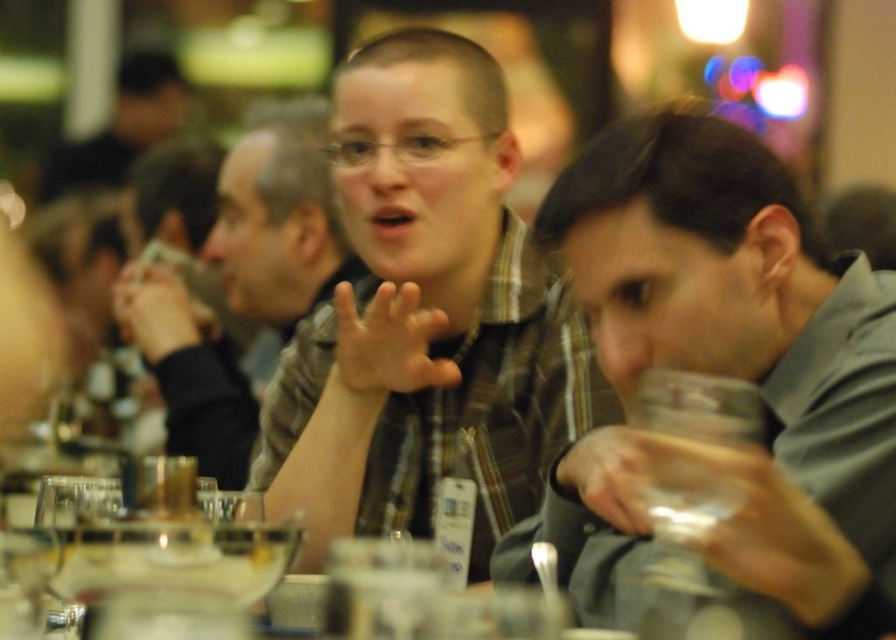
Is gray matte glass at right to the right of plaid shirt at center from the viewer's perspective?

Indeed, gray matte glass at right is positioned on the right side of plaid shirt at center.

Between point (817, 531) and point (182, 346), which one is positioned in front?

Point (817, 531)

At what (x,y) coordinates should I click in order to perform the action: click on gray matte glass at right. Please return your answer as a coordinate pair (x, y). Looking at the image, I should click on click(747, 346).

In the scene shown: Is gray matte glass at right shorter than transparent plastic wine glass at right?

In fact, gray matte glass at right may be taller than transparent plastic wine glass at right.

Can you confirm if gray matte glass at right is positioned below transparent plastic wine glass at right?

No, gray matte glass at right is not below transparent plastic wine glass at right.

Measure the distance between point (612, 150) and camera.

Point (612, 150) and camera are 3.42 feet apart.

This screenshot has width=896, height=640. What are the coordinates of `gray matte glass at right` in the screenshot? It's located at (747, 346).

Does plaid shirt at center appear on the left side of transparent plastic wine glass at right?

Correct, you'll find plaid shirt at center to the left of transparent plastic wine glass at right.

Is point (191, 348) closer to camera compared to point (730, 416)?

No, (191, 348) is further to viewer.

Locate an element on the screen. Image resolution: width=896 pixels, height=640 pixels. plaid shirt at center is located at coordinates (277, 228).